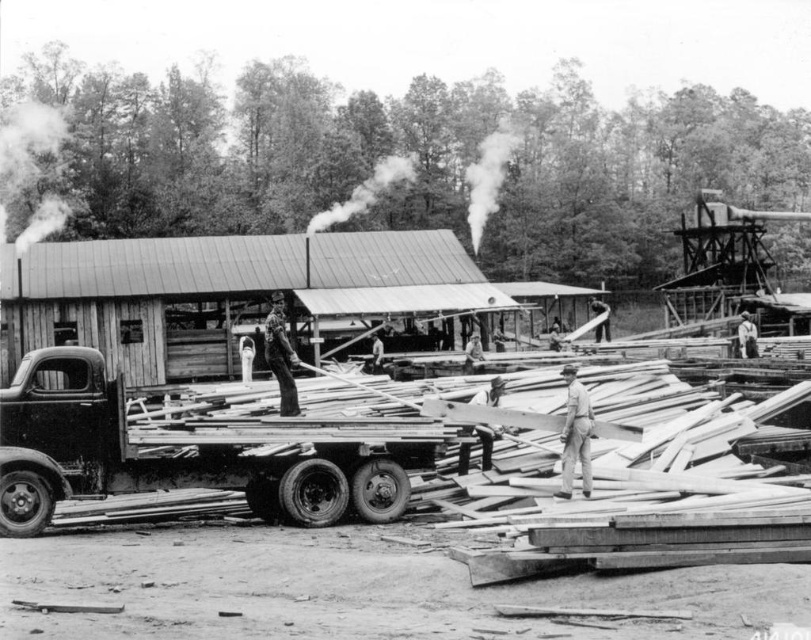
Is point (92, 342) closer to camera compared to point (367, 484)?

No, it is not.

Does wooden hut at center have a lesser height compared to rusty metal trailer truck at center?

Incorrect, wooden hut at center's height does not fall short of rusty metal trailer truck at center's.

The height and width of the screenshot is (640, 811). In order to click on wooden hut at center in this screenshot , I will do `click(224, 292)`.

Does light brown wooden man at center appear on the left side of wooden planks at center?

In fact, light brown wooden man at center is to the right of wooden planks at center.

Does light brown wooden man at center have a greater height compared to wooden planks at center?

Incorrect, light brown wooden man at center's height is not larger of wooden planks at center's.

What do you see at coordinates (575, 435) in the screenshot? The width and height of the screenshot is (811, 640). I see `light brown wooden man at center` at bounding box center [575, 435].

Identify the location of light brown wooden man at center. tap(575, 435).

Is smooth wood boards at center taller than light brown wooden man at center?

Indeed, smooth wood boards at center has a greater height compared to light brown wooden man at center.

Where is `smooth wood boards at center`? The height and width of the screenshot is (640, 811). smooth wood boards at center is located at coordinates (221, 444).

I want to click on smooth wood boards at center, so click(221, 444).